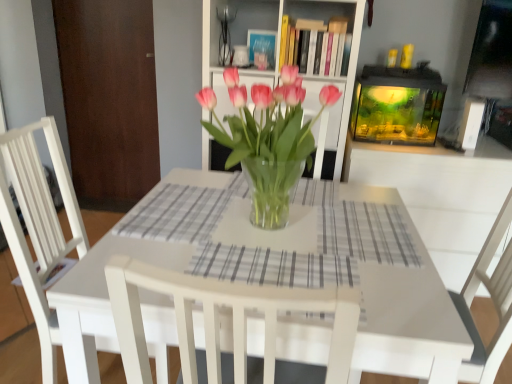
Question: Considering the positions of white wood chair at center and brown wood door at left in the image, is white wood chair at center bigger or smaller than brown wood door at left?

Choices:
 (A) big
 (B) small

Answer: (A)

Question: Does point [x=44, y=231] appear closer or farther from the camera than point [x=102, y=173]?

Choices:
 (A) closer
 (B) farther

Answer: (A)

Question: Which of these objects is positioned farthest from the white wood chair at center?

Choices:
 (A) translucent glass vase at center
 (B) gray checkered placemat at center, placed as the first plaid when sorted from top to bottom
 (C) brown wood door at left
 (D) gray checkered placemat at center, acting as the 1th plaid starting from the front
 (E) transparent glass vase at center

Answer: (C)

Question: Which object is positioned farthest from the transparent glass vase at center?

Choices:
 (A) gray checkered placemat at center, the 1th plaid viewed from the left
 (B) gray checkered placemat at center, positioned as the 2th plaid in left-to-right order
 (C) white wood chair at center
 (D) translucent glass vase at center
 (E) white glossy table at center

Answer: (C)